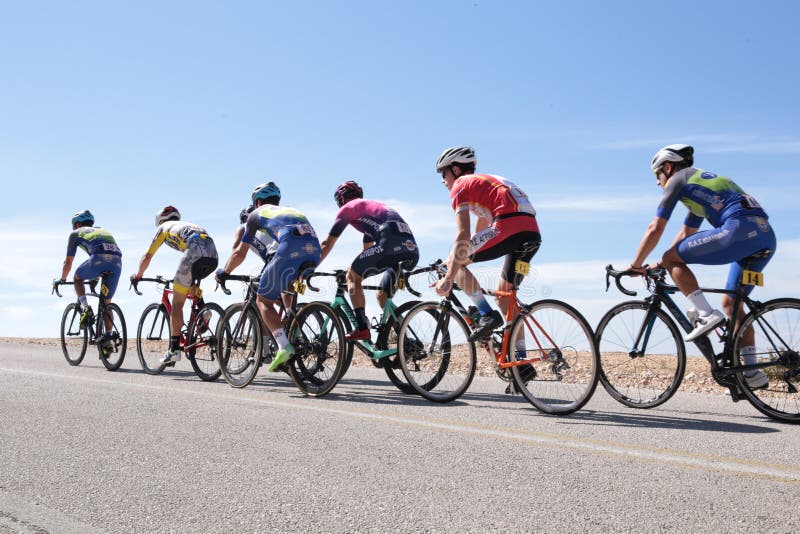
Locate an element on the screen. The height and width of the screenshot is (534, 800). seats is located at coordinates (761, 262), (529, 246), (402, 263), (304, 264), (204, 264), (108, 274).